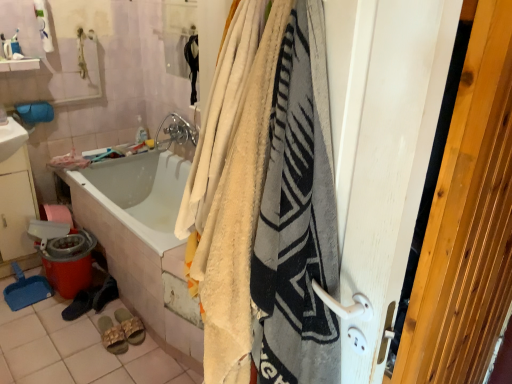
Locate an element on the screen. free space above gold fabric slippers at lower center, positioned as the 3th footwear in left-to-right order (from a real-world perspective) is located at coordinates (116, 330).